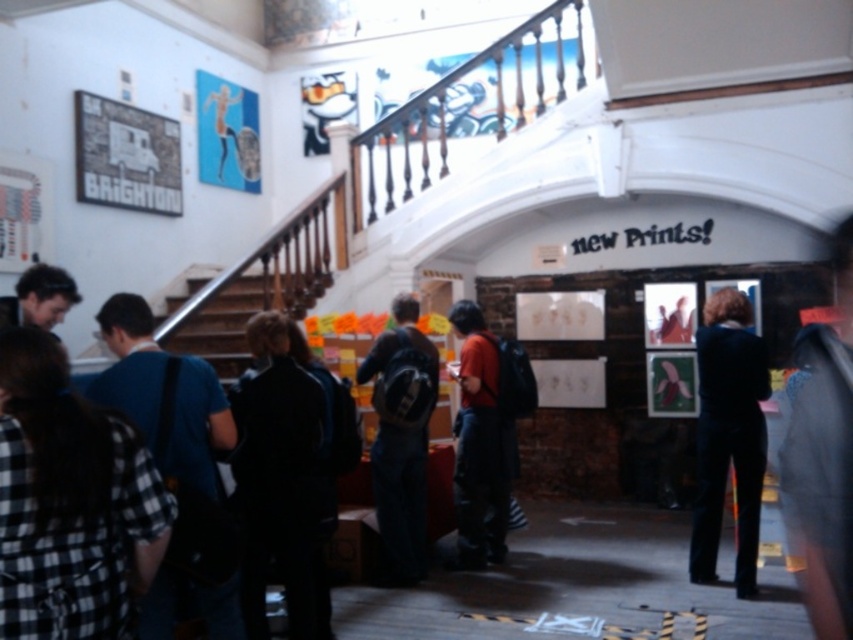
Question: Is checkered fabric shirt at left to the left of black fabric jacket at center from the viewer's perspective?

Choices:
 (A) no
 (B) yes

Answer: (B)

Question: Is black fabric jacket at center bigger than blue fabric shirt at left?

Choices:
 (A) no
 (B) yes

Answer: (B)

Question: Does blue fabric shirt at left lie in front of orange shirt at center?

Choices:
 (A) yes
 (B) no

Answer: (A)

Question: Which point is closer to the camera taking this photo?

Choices:
 (A) (416, 300)
 (B) (120, 451)

Answer: (B)

Question: Which point is farther from the camera taking this photo?

Choices:
 (A) tap(132, 419)
 (B) tap(254, 480)

Answer: (B)

Question: Which object appears closest to the camera in this image?

Choices:
 (A) checkered fabric shirt at left
 (B) metallic staircase at center
 (C) orange shirt at center
 (D) dark blue backpack at center

Answer: (A)